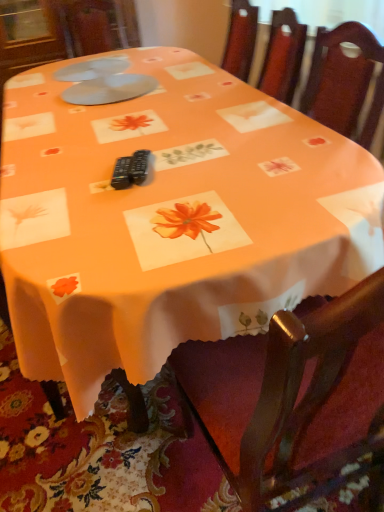
Question: Which direction should I rotate to look at matte plastic plates at upper center, the first tableware positioned from the front, — up or down?

Choices:
 (A) up
 (B) down

Answer: (A)

Question: Is white plastic plates at upper center, the 2th tableware from the front, taller than matte plastic plates at upper center, marked as the 2th tableware in a back-to-front arrangement?

Choices:
 (A) no
 (B) yes

Answer: (A)

Question: Are white plastic plates at upper center, the first tableware positioned from the back, and matte plastic plates at upper center, the first tableware positioned from the front, beside each other?

Choices:
 (A) no
 (B) yes

Answer: (A)

Question: Is white plastic plates at upper center, the first tableware positioned from the back, completely or partially outside of matte plastic plates at upper center, marked as the 2th tableware in a back-to-front arrangement?

Choices:
 (A) yes
 (B) no

Answer: (A)

Question: Is white plastic plates at upper center, the first tableware positioned from the back, bigger than matte plastic plates at upper center, the first tableware positioned from the front?

Choices:
 (A) yes
 (B) no

Answer: (B)

Question: Is white plastic plates at upper center, the 2th tableware from the front, facing towards matte plastic plates at upper center, the first tableware positioned from the front?

Choices:
 (A) no
 (B) yes

Answer: (A)

Question: Considering the relative sizes of white plastic plates at upper center, the 2th tableware from the front, and matte plastic plates at upper center, marked as the 2th tableware in a back-to-front arrangement, in the image provided, is white plastic plates at upper center, the 2th tableware from the front, wider than matte plastic plates at upper center, marked as the 2th tableware in a back-to-front arrangement,?

Choices:
 (A) yes
 (B) no

Answer: (B)

Question: From a real-world perspective, is matte plastic plates at upper center, the first tableware positioned from the front, located beneath white plastic plates at upper center, the first tableware positioned from the back?

Choices:
 (A) no
 (B) yes

Answer: (B)

Question: Does matte plastic plates at upper center, marked as the 2th tableware in a back-to-front arrangement, come behind white plastic plates at upper center, the first tableware positioned from the back?

Choices:
 (A) yes
 (B) no

Answer: (B)

Question: Does matte plastic plates at upper center, marked as the 2th tableware in a back-to-front arrangement, contain white plastic plates at upper center, the first tableware positioned from the back?

Choices:
 (A) yes
 (B) no

Answer: (B)

Question: Is matte plastic plates at upper center, the first tableware positioned from the front, directly adjacent to white plastic plates at upper center, the first tableware positioned from the back?

Choices:
 (A) yes
 (B) no

Answer: (B)

Question: Is matte plastic plates at upper center, marked as the 2th tableware in a back-to-front arrangement, thinner than white plastic plates at upper center, the first tableware positioned from the back?

Choices:
 (A) yes
 (B) no

Answer: (B)

Question: Does matte plastic plates at upper center, the first tableware positioned from the front, have a greater height compared to white plastic plates at upper center, the 2th tableware from the front?

Choices:
 (A) no
 (B) yes

Answer: (B)

Question: Visually, is white plastic plates at upper center, the 2th tableware from the front, positioned to the left or to the right of matte plastic plates at upper center, marked as the 2th tableware in a back-to-front arrangement?

Choices:
 (A) right
 (B) left

Answer: (B)